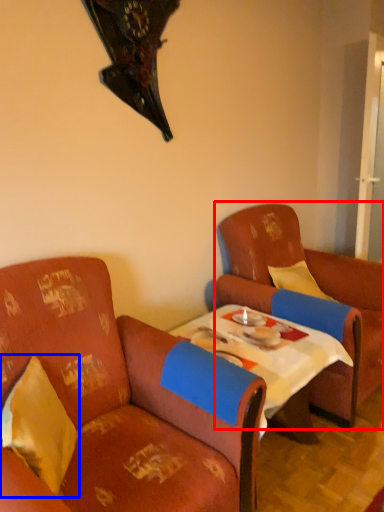
Question: Which of the following is the closest to the observer, chair (highlighted by a red box) or pillow (highlighted by a blue box)?

Choices:
 (A) chair
 (B) pillow

Answer: (B)